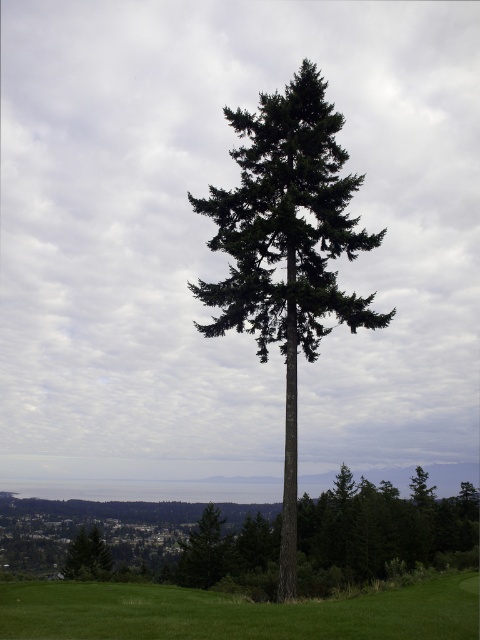
Is green grassy field at center to the right of green matte tree at lower left from the viewer's perspective?

Correct, you'll find green grassy field at center to the right of green matte tree at lower left.

Between point (373, 608) and point (100, 566), which one is positioned in front?

Positioned in front is point (373, 608).

Does point (427, 609) come behind point (79, 547)?

That is False.

The height and width of the screenshot is (640, 480). Find the location of `green grassy field at center`. green grassy field at center is located at coordinates (238, 612).

Is green matte tree at center positioned behind green grassy field at center?

That is True.

What do you see at coordinates (287, 250) in the screenshot?
I see `green matte tree at center` at bounding box center [287, 250].

Where is `green matte tree at center`? green matte tree at center is located at coordinates (287, 250).

What are the coordinates of `green matte tree at center` in the screenshot? It's located at (287, 250).

Which is in front, point (309, 220) or point (104, 564)?

Point (309, 220)

Is green matte tree at center shorter than green matte tree at lower left?

Incorrect, green matte tree at center's height does not fall short of green matte tree at lower left's.

Where is `green matte tree at center`? Image resolution: width=480 pixels, height=640 pixels. green matte tree at center is located at coordinates click(x=287, y=250).

You are a GUI agent. You are given a task and a screenshot of the screen. Output one action in this format:
    pyautogui.click(x=<x>, y=<y>)
    Task: Click on the green matte tree at center
    The image size is (480, 640).
    Given the screenshot: What is the action you would take?
    pyautogui.click(x=287, y=250)